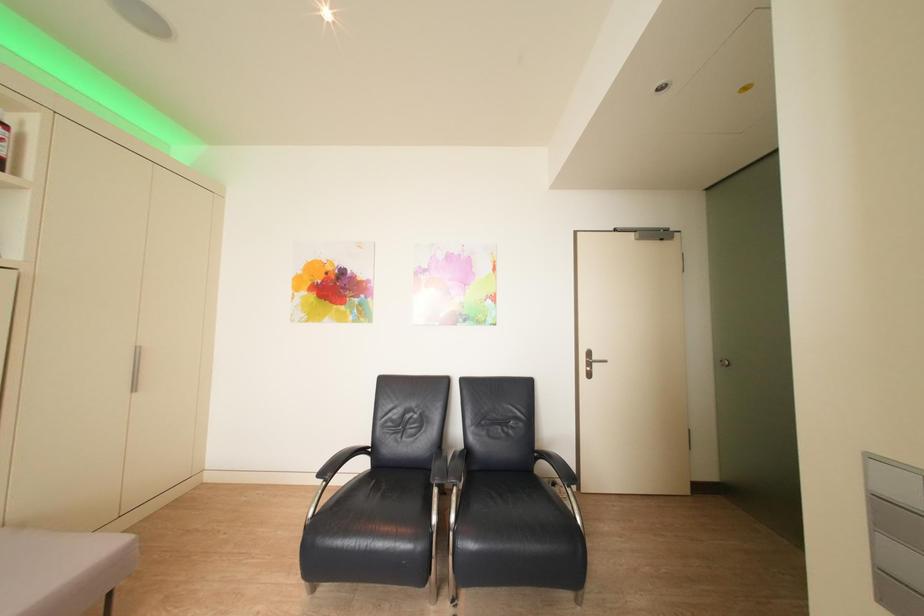
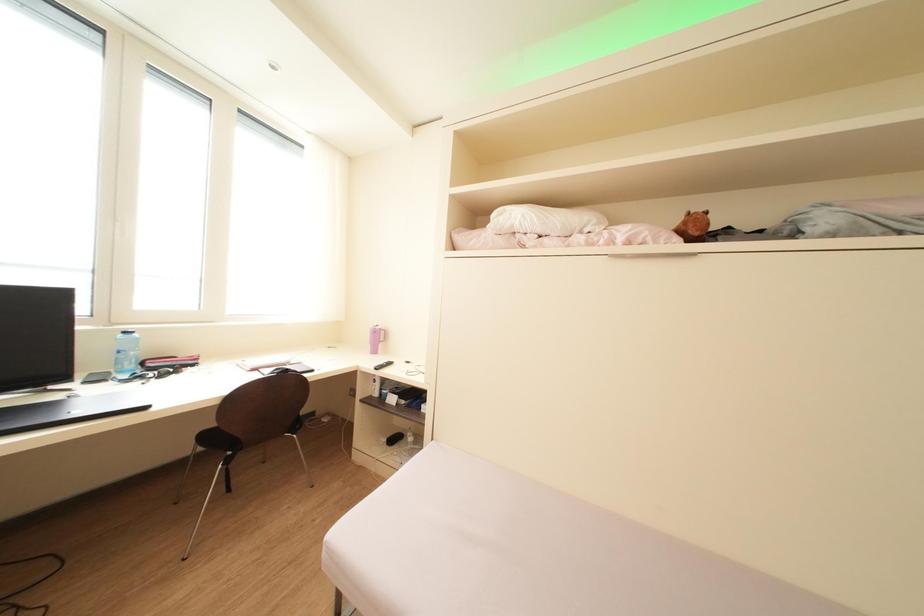
Question: The camera is either moving clockwise (left) or counter-clockwise (right) around the object. The first image is from the beginning of the video and the second image is from the end. Is the camera moving left or right when shooting the video?

Choices:
 (A) Left
 (B) Right

Answer: (B)